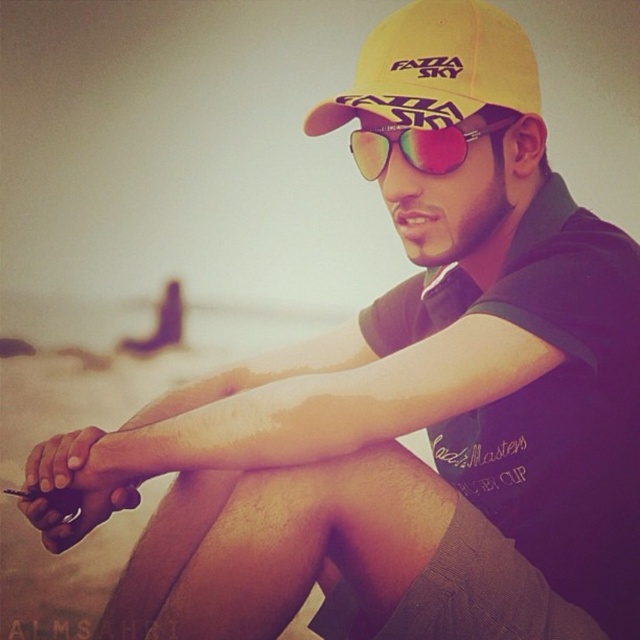
You are a photographer trying to capture the best angle of the person wearing the yellow fabric baseball cap at upper center. Given that the cap is located at point (435, 68), where should you position your camera to ensure the cap is centered in your shot?

To center the yellow fabric baseball cap at upper center in your shot, position your camera so that the cap aligns with the center point of your viewfinder, which corresponds to the coordinates (435, 68). This ensures the cap is precisely at the focal point of the image.

You are a photographer trying to capture the perfect shot of the person in the scene. You notice the yellow fabric baseball cap at upper center and the multicolored reflective sunglasses at center. Which object is located to the left of the other?

The yellow fabric baseball cap at upper center is positioned on the left side of multicolored reflective sunglasses at center.

Based on the scene description, can you determine if the yellow fabric baseball cap at upper center is wider than the multicolored reflective sunglasses at center?

The yellow fabric baseball cap at upper center might be wider than multicolored reflective sunglasses at center according to the description provided.